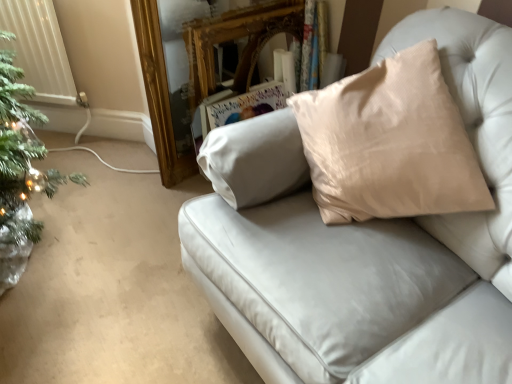
Question: Does satin beige pillow at upper right have a lesser height compared to white plastic radiator at left?

Choices:
 (A) no
 (B) yes

Answer: (A)

Question: Is satin beige pillow at upper right further to camera compared to white plastic radiator at left?

Choices:
 (A) no
 (B) yes

Answer: (A)

Question: Is satin beige pillow at upper right looking in the opposite direction of white plastic radiator at left?

Choices:
 (A) yes
 (B) no

Answer: (B)

Question: From the image's perspective, would you say satin beige pillow at upper right is positioned over white plastic radiator at left?

Choices:
 (A) no
 (B) yes

Answer: (A)

Question: From a real-world perspective, does satin beige pillow at upper right sit lower than white plastic radiator at left?

Choices:
 (A) yes
 (B) no

Answer: (B)

Question: Is satin beige pillow at upper right to the right of white plastic radiator at left from the viewer's perspective?

Choices:
 (A) no
 (B) yes

Answer: (B)

Question: From a real-world perspective, is white plastic radiator at left over gold ornate mirror at upper center?

Choices:
 (A) yes
 (B) no

Answer: (A)

Question: Is white plastic radiator at left aimed at gold ornate mirror at upper center?

Choices:
 (A) yes
 (B) no

Answer: (B)

Question: Is gold ornate mirror at upper center inside white plastic radiator at left?

Choices:
 (A) no
 (B) yes

Answer: (A)

Question: From a real-world perspective, is white plastic radiator at left physically below gold ornate mirror at upper center?

Choices:
 (A) no
 (B) yes

Answer: (A)

Question: Can you confirm if white plastic radiator at left is taller than gold ornate mirror at upper center?

Choices:
 (A) no
 (B) yes

Answer: (A)

Question: Are white plastic radiator at left and gold ornate mirror at upper center located far from each other?

Choices:
 (A) yes
 (B) no

Answer: (B)

Question: From a real-world perspective, is satin beige pillow at upper right below gold ornate mirror at upper center?

Choices:
 (A) yes
 (B) no

Answer: (B)